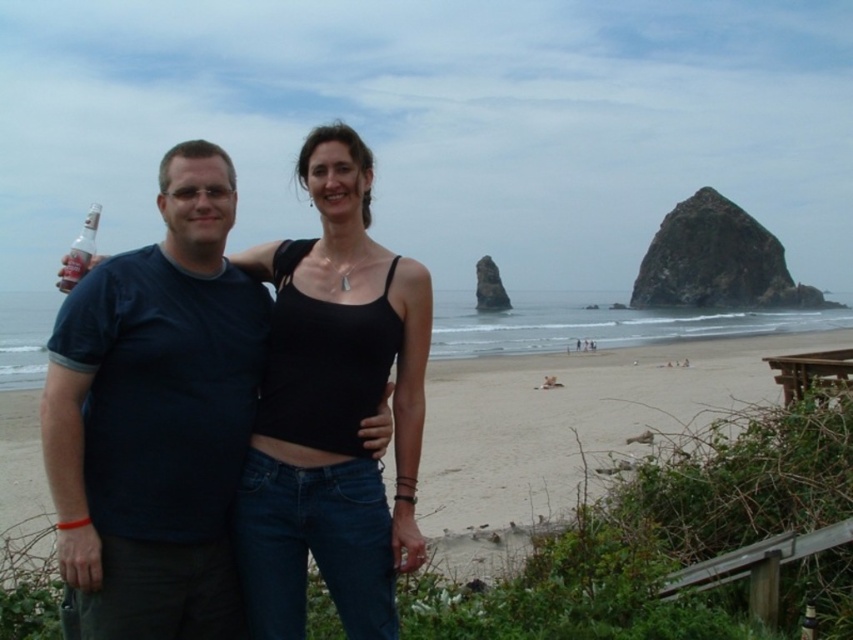
Is dark blue t-shirt at left behind smooth sand beach at center?

No.

Can you confirm if dark blue t-shirt at left is positioned to the right of smooth sand beach at center?

Incorrect, dark blue t-shirt at left is not on the right side of smooth sand beach at center.

The image size is (853, 640). Find the location of `dark blue t-shirt at left`. dark blue t-shirt at left is located at coordinates (155, 419).